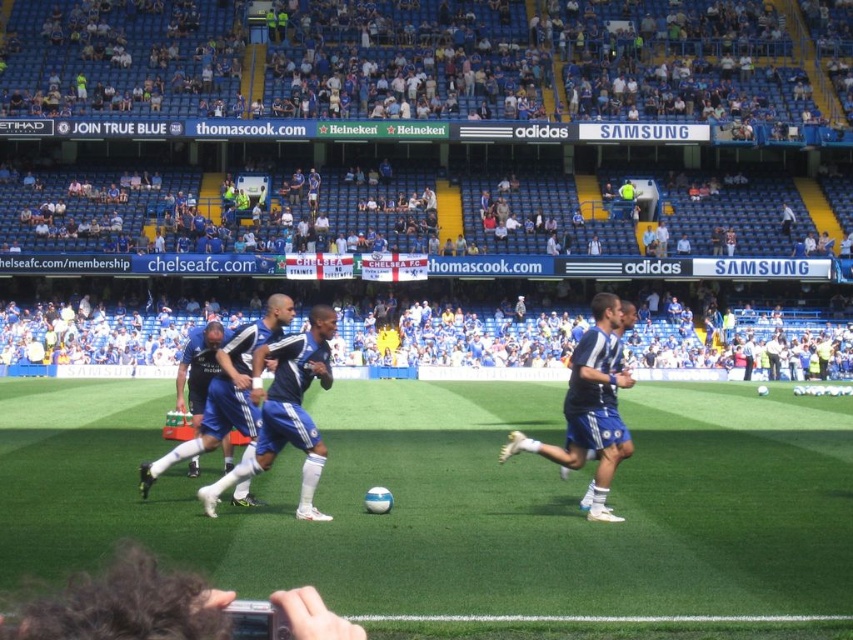
You are a photographer taking a picture of the soccer match. You have two points marked in your viewfinder at coordinates point (225,362) and point (523,444). Which point is closer to the camera?

Point (523,444) is closer to the camera because point (225,362) is further away from the camera than point (523,444).

You are a soccer player trying to kick the ball that is on the green artificial turf at center. However, there is a blue fabric jersey at center in your way. Can you kick the ball without moving the jersey?

The green artificial turf at center is positioned under the blue fabric jersey at center, meaning the jersey is lying on top of the turf where the ball is. To kick the ball, you would need to move the jersey first to access the ball beneath it.

You are a photographer at the soccer match and want to capture both the blue fabric jersey at center and the blue fabric shorts at right in a single shot. Since you want both to be clearly visible, which object should you focus on to ensure the larger one is in sharp focus?

The blue fabric jersey at center is larger in size than the blue fabric shorts at right, so you should focus on the blue fabric jersey at center to ensure the larger object is in sharp focus.